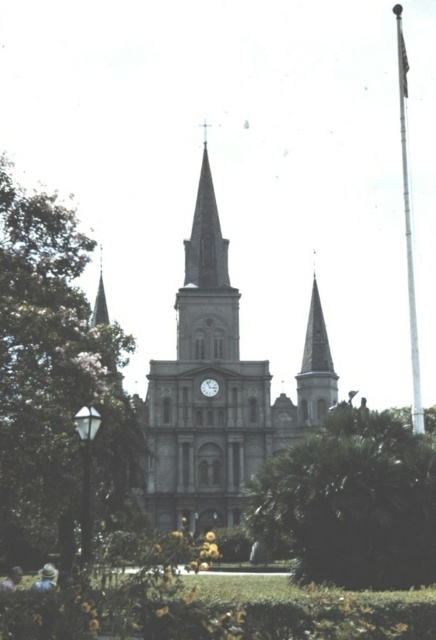
You are a tourist standing in front of the church and want to take a photo that includes both the green leafy tree at left and the smooth stone steeple at center. Based on their positions, where should you position yourself to ensure both are visible in the frame?

To include both the green leafy tree at left and the smooth stone steeple at center in your photo, position yourself to the right of the green leafy tree at left since it is located to the left of the smooth stone steeple at center.

You are a tourist visiting the church and want to take a photo that includes both the green leafy tree at left and the metallic gray clock at center. Given their sizes, which object will appear larger in your photo?

The green leafy tree at left will appear larger in the photo because it is bigger than the metallic gray clock at center.

You are standing in front of the historic church and want to take a photo of the green leafy tree at center. If your camera can focus on objects up to 150 meters away, will you be able to capture the tree clearly?

The green leafy tree at center is 137.52 meters away from the viewer, which is within the camera focus range of up to 150 meters. Therefore, you can capture the tree clearly.